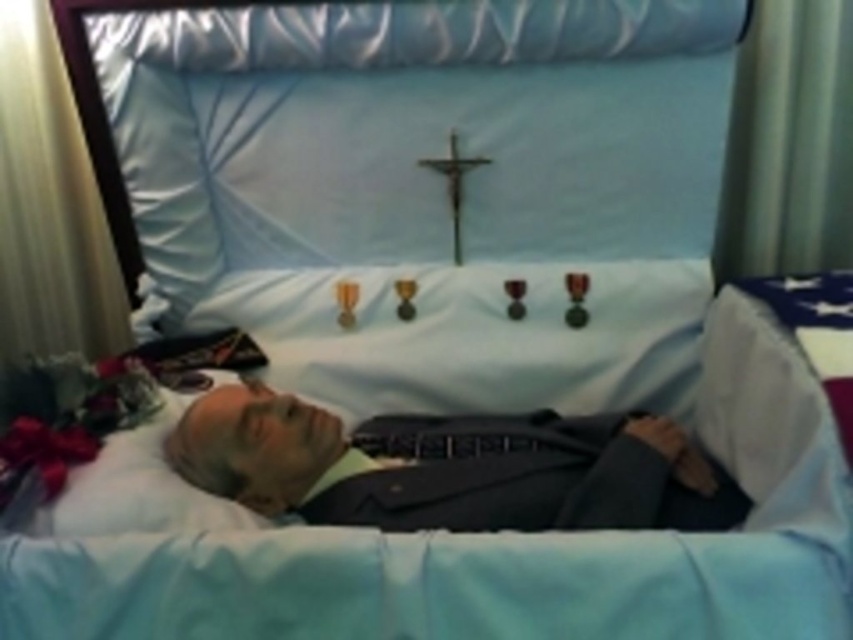
Question: Which object is closer to the camera taking this photo?

Choices:
 (A) dark gray suit at center
 (B) metallic crucifix at center

Answer: (A)

Question: Is dark gray suit at center below metallic crucifix at center?

Choices:
 (A) no
 (B) yes

Answer: (B)

Question: Is dark gray suit at center thinner than metallic crucifix at center?

Choices:
 (A) no
 (B) yes

Answer: (A)

Question: Does dark gray suit at center have a larger size compared to metallic crucifix at center?

Choices:
 (A) yes
 (B) no

Answer: (A)